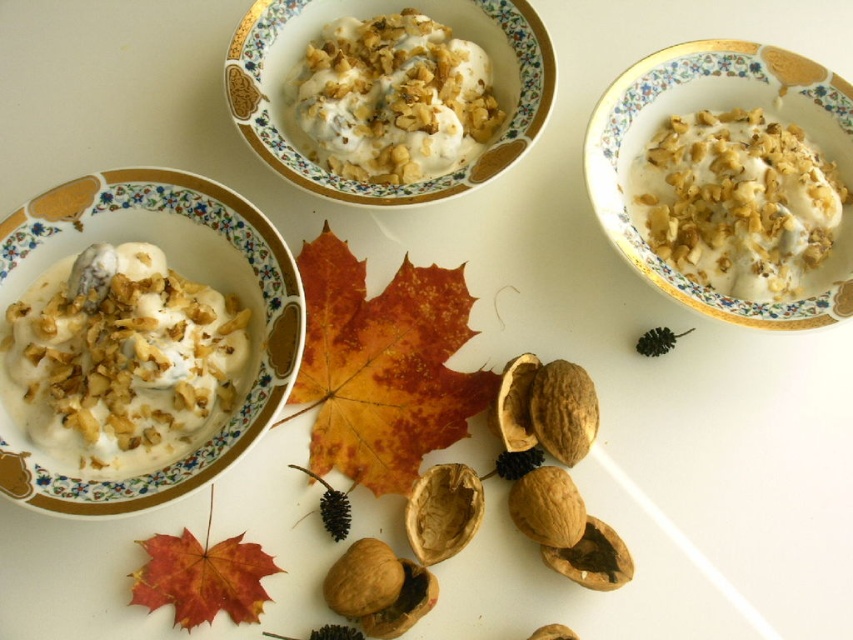
You are a photographer setting up a shot of the autumn dessert display. You want to position your camera so that the point at point (83, 193) is visible without being blocked by point (247, 586). Based on the scene description, where should you place your camera relative to these points?

Since point (83, 193) is behind point (247, 586), the camera should be positioned in front of point (247, 586) so that point (83, 193) is visible behind it.

You are a food stylist arranging a dessert display. You have to place a new decorative item between the white creamy ice cream with crunchy nuts at center and the orange matte maple leaf at lower left. Where should you place it so it sits exactly halfway between them?

The white creamy ice cream with crunchy nuts at center is above the orange matte maple leaf at lower left. To place the new decorative item exactly halfway between them, position it midway along the vertical line connecting the two objects, ensuring it is equidistant from both.

You are a food stylist arranging a dessert display. You have a white creamy ice cream with crunchy nuts at center and an orange matte maple leaf at lower left. Based on their positions and heights, which item would cast a longer shadow if the light source is coming from above?

The white creamy ice cream with crunchy nuts at center is taller than the orange matte maple leaf at lower left, so it would cast a longer shadow.